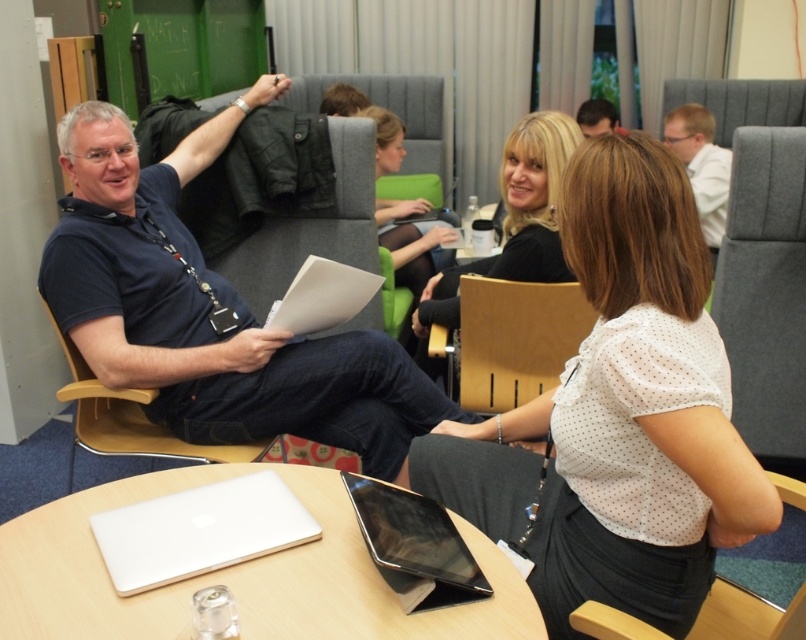
You are sitting in the gray fabric chair at right and want to reach the black fabric chair at center. Which direction should you move to get there?

The gray fabric chair at right is located above the black fabric chair at center, so you should move downward to reach it.

You are sitting at the round wooden table in the foreground and need to place your white matte laptop at lower center on the table. Where should you place it in relation to the black fabric chair at center?

The white matte laptop at lower center should be placed on the left side of the black fabric chair at center.

From the picture: You are standing at the entrance of the room and want to place a new white matte laptop at lower center at point (198, 531). Is there enough space there?

Yes, because the white matte laptop at lower center is already located at point (198, 531), indicating that there is sufficient space.